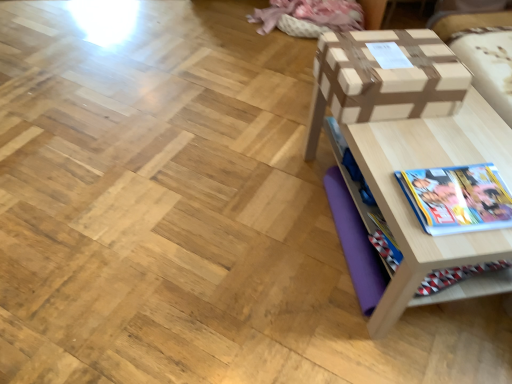
Find the location of `vacant space in between hardcover book at lower right and brown cardboard box at upper right`. vacant space in between hardcover book at lower right and brown cardboard box at upper right is located at coordinates (420, 149).